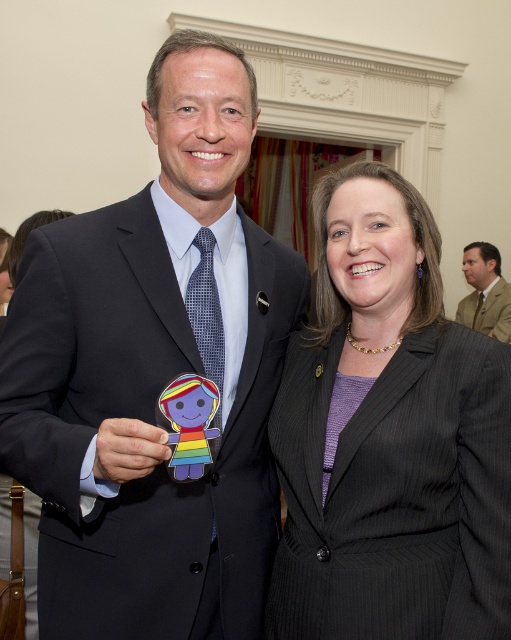
You are a photographer at an event and need to capture a photo of the black pinstripe suit at center and the tan fabric suit at right. Which of the two suits should you focus on first if you want to highlight the larger one in your composition?

The black pinstripe suit at center is bigger than the tan fabric suit at right, so you should focus on the black pinstripe suit at center first to highlight its larger size in the composition.

You are standing at the point marked by the coordinates point [375,616]. You want to reach the door located behind the two people in the scene. The door is 2.5 meters away from your current position. Can you walk straight to the door without moving around the people?

The point [375,616] and viewer are 1.11 meters apart from each other. Since the door is 2.5 meters away from your current position, you can walk straight to the door without needing to move around the people as the distance is sufficient.

You are standing 1.2 meters away from the point marked at coordinates (82,316). Can you reach that point without moving your feet?

The distance between you and the point marked at coordinates (82,316) is 1.19 meters. Since you are already 1.2 meters away, you cannot reach it without moving your feet.